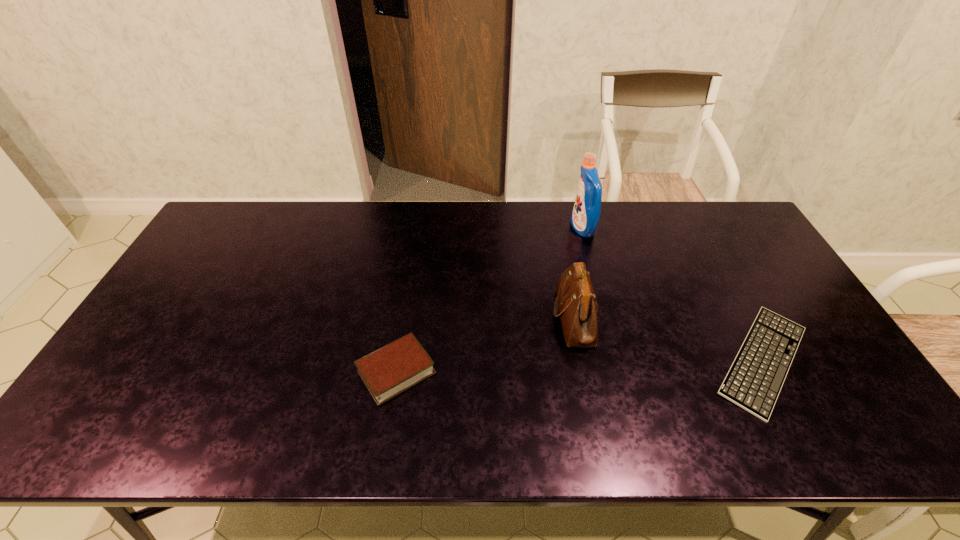
I want to click on free spot located 0.210m on the front of the third shortest object, so click(596, 427).

Where is `free region located on the left of the leftmost object`? Image resolution: width=960 pixels, height=540 pixels. free region located on the left of the leftmost object is located at coordinates (219, 372).

Locate an element on the screen. The height and width of the screenshot is (540, 960). vacant area situated 0.070m on the left of the computer keyboard is located at coordinates (675, 360).

At what (x,y) coordinates should I click in order to perform the action: click on object that is at the far edge. Please return your answer as a coordinate pair (x, y). The height and width of the screenshot is (540, 960). Looking at the image, I should click on (585, 216).

The image size is (960, 540). What are the coordinates of `object present at the near edge` in the screenshot? It's located at (755, 378).

Locate an element on the screen. The image size is (960, 540). object positioned at the right edge is located at coordinates (755, 378).

At what (x,y) coordinates should I click in order to perform the action: click on object that is at the near right corner. Please return your answer as a coordinate pair (x, y). The width and height of the screenshot is (960, 540). Looking at the image, I should click on (755, 378).

Identify the location of vacant space at the far edge of the desktop. (411, 206).

Locate an element on the screen. vacant space at the near edge is located at coordinates (437, 421).

In the image, there is a desktop. Where is `vacant space at the left edge`? Image resolution: width=960 pixels, height=540 pixels. vacant space at the left edge is located at coordinates (152, 325).